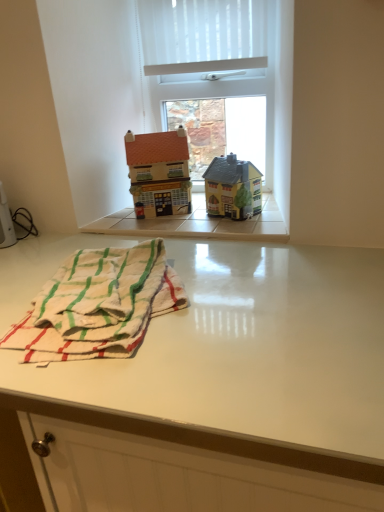
Question: Considering the relative sizes of white woven beach towel at lower left and matte brown house at center, marked as the 2th toy in a right-to-left arrangement, in the image provided, is white woven beach towel at lower left smaller than matte brown house at center, marked as the 2th toy in a right-to-left arrangement,?

Choices:
 (A) no
 (B) yes

Answer: (A)

Question: Is white woven beach towel at lower left directly adjacent to matte brown house at center, placed as the 1th toy when sorted from left to right?

Choices:
 (A) no
 (B) yes

Answer: (A)

Question: Could matte brown house at center, marked as the 2th toy in a right-to-left arrangement, be considered to be inside white woven beach towel at lower left?

Choices:
 (A) no
 (B) yes

Answer: (A)

Question: From a real-world perspective, does white woven beach towel at lower left stand above matte brown house at center, placed as the 1th toy when sorted from left to right?

Choices:
 (A) yes
 (B) no

Answer: (B)

Question: Can you confirm if white woven beach towel at lower left is positioned to the left of matte brown house at center, placed as the 1th toy when sorted from left to right?

Choices:
 (A) yes
 (B) no

Answer: (A)

Question: Is yellow matte house at center, which is counted as the second toy, starting from the left, spatially inside white woven beach towel at lower left, or outside of it?

Choices:
 (A) inside
 (B) outside

Answer: (B)

Question: Is yellow matte house at center, which is counted as the second toy, starting from the left, taller or shorter than white woven beach towel at lower left?

Choices:
 (A) tall
 (B) short

Answer: (A)

Question: Looking at the image, does yellow matte house at center, which is counted as the second toy, starting from the left, seem bigger or smaller compared to white woven beach towel at lower left?

Choices:
 (A) big
 (B) small

Answer: (B)

Question: Is point (244, 206) positioned closer to the camera than point (155, 279)?

Choices:
 (A) closer
 (B) farther

Answer: (B)

Question: Based on their positions, is white plastic window at upper center located to the left or right of matte brown house at center, placed as the 1th toy when sorted from left to right?

Choices:
 (A) right
 (B) left

Answer: (A)

Question: In terms of size, does white plastic window at upper center appear bigger or smaller than matte brown house at center, placed as the 1th toy when sorted from left to right?

Choices:
 (A) small
 (B) big

Answer: (B)

Question: Is point (274, 32) positioned closer to the camera than point (177, 153)?

Choices:
 (A) closer
 (B) farther

Answer: (A)

Question: From the image's perspective, is white plastic window at upper center located above or below matte brown house at center, placed as the 1th toy when sorted from left to right?

Choices:
 (A) above
 (B) below

Answer: (A)

Question: Visually, is white woven beach towel at lower left positioned to the left or to the right of white glossy table at lower center?

Choices:
 (A) right
 (B) left

Answer: (A)

Question: Is white woven beach towel at lower left taller or shorter than white glossy table at lower center?

Choices:
 (A) tall
 (B) short

Answer: (B)